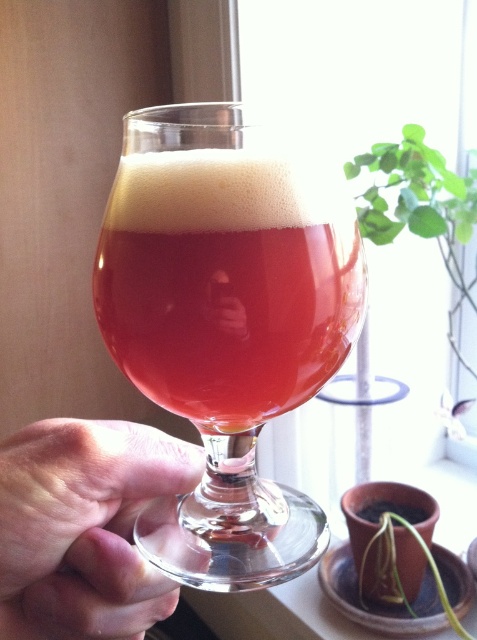
Can you confirm if transparent glass at lower center is smaller than green leafy plant at lower right?

Incorrect, transparent glass at lower center is not smaller in size than green leafy plant at lower right.

Does transparent glass at lower center appear on the right side of green leafy plant at lower right?

No, transparent glass at lower center is not to the right of green leafy plant at lower right.

The image size is (477, 640). In order to click on transparent glass at lower center in this screenshot , I will do `click(84, 528)`.

Image resolution: width=477 pixels, height=640 pixels. I want to click on transparent glass at lower center, so click(84, 528).

Is transparent glass at center bigger than transparent glass at lower center?

Yes, transparent glass at center is bigger than transparent glass at lower center.

The height and width of the screenshot is (640, 477). I want to click on transparent glass at center, so click(226, 324).

In the scene shown: Which of these two, green leafy plant at upper right or green leafy plant at lower right, stands taller?

Standing taller between the two is green leafy plant at upper right.

Is green leafy plant at upper right behind green leafy plant at lower right?

That is True.

Which is in front, point (459, 280) or point (449, 604)?

Point (449, 604) is more forward.

This screenshot has height=640, width=477. Find the location of `green leafy plant at upper right`. green leafy plant at upper right is located at coordinates coord(420,205).